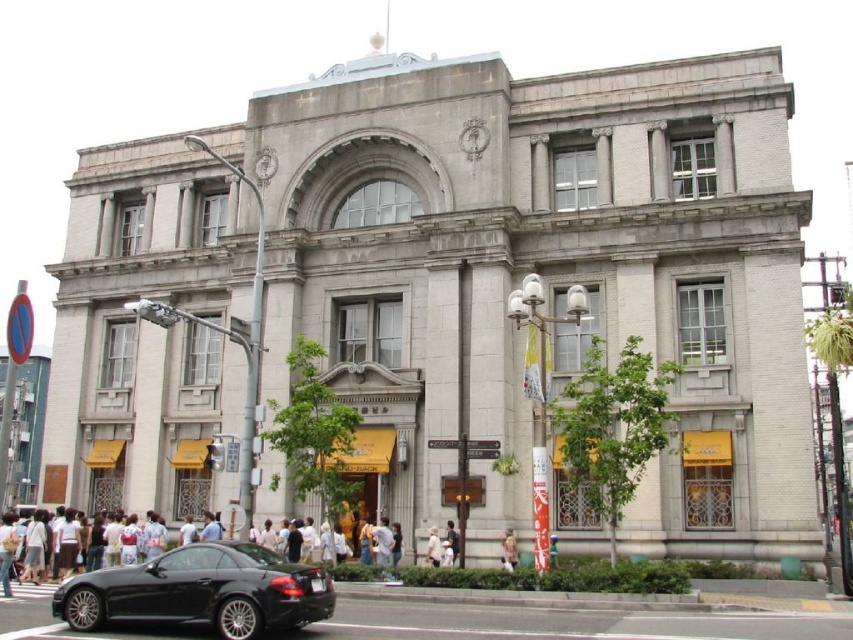
Question: Can you confirm if shiny black car at center is bigger than white cotton shirt at center?

Choices:
 (A) yes
 (B) no

Answer: (A)

Question: Which object is farther from the camera taking this photo?

Choices:
 (A) white cotton shirt at center
 (B) light brown fabric bag at lower center

Answer: (A)

Question: Where is light brown fabric bag at lower center located in relation to white cotton shirt at center in the image?

Choices:
 (A) right
 (B) left

Answer: (A)

Question: Which point is farther to the camera?

Choices:
 (A) white cotton shirt at center
 (B) light brown fabric bag at lower center

Answer: (A)

Question: Which of the following is the farthest from the observer?

Choices:
 (A) white cotton shirt at center
 (B) shiny black car at center

Answer: (A)

Question: Can you confirm if light brown fabric bag at lower center is positioned below white cotton shirt at center?

Choices:
 (A) no
 (B) yes

Answer: (A)